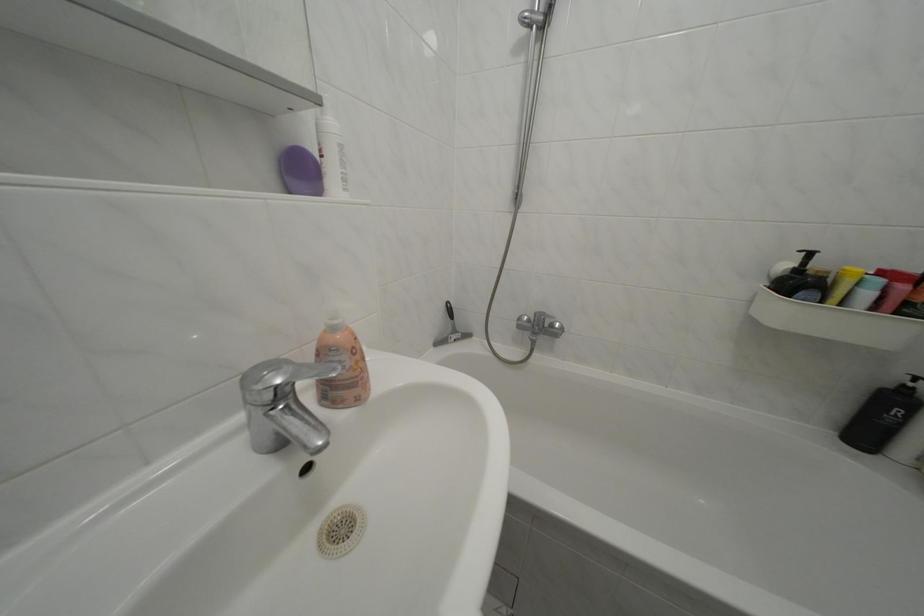
At what (x,y) coordinates should I click in order to perform the action: click on shower faucet knob. Please return your answer as a coordinate pair (x, y). Looking at the image, I should click on (544, 323).